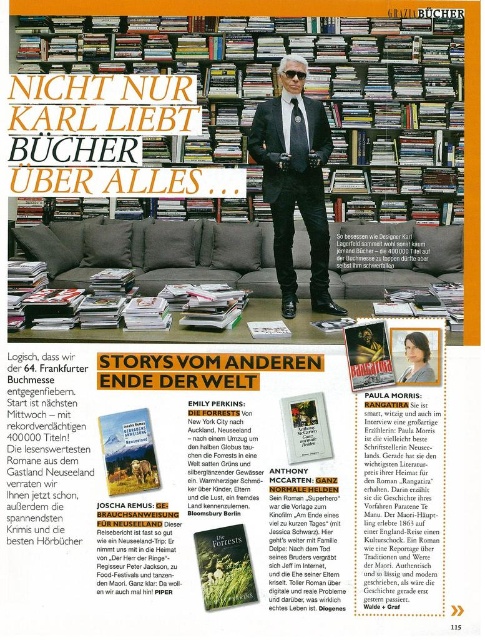
Is wooden bookshelf at upper center thinner than matte white paper at center?

No.

Between wooden bookshelf at upper center and matte white paper at center, which one has less height?

matte white paper at center

Does point (252, 115) come closer to viewer compared to point (264, 333)?

No, it is behind (264, 333).

Where is `wooden bookshelf at upper center`? wooden bookshelf at upper center is located at coordinates (307, 90).

Can you confirm if matte green paper at center is smaller than hardcover book at center?

Yes, matte green paper at center is smaller than hardcover book at center.

Between point (249, 566) and point (373, 378), which one is positioned in front?

Point (249, 566)

Where is `matte green paper at center`? matte green paper at center is located at coordinates (x=225, y=566).

Which is more to the left, matte white paper at center or black plastic goggles at upper center?

Positioned to the left is matte white paper at center.

Measure the distance from matte white paper at center to black plastic goggles at upper center.

A distance of 4.18 feet exists between matte white paper at center and black plastic goggles at upper center.

Between point (263, 323) and point (284, 76), which one is positioned in front?

Point (263, 323) is more forward.

I want to click on matte white paper at center, so click(x=269, y=330).